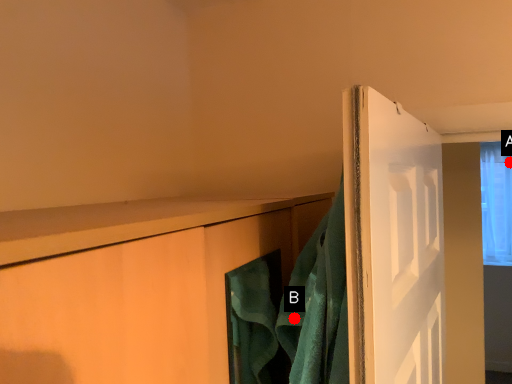
Question: Two points are circled on the image, labeled by A and B beside each circle. Among these points, which one is nearest to the camera?

Choices:
 (A) A is closer
 (B) B is closer

Answer: (B)